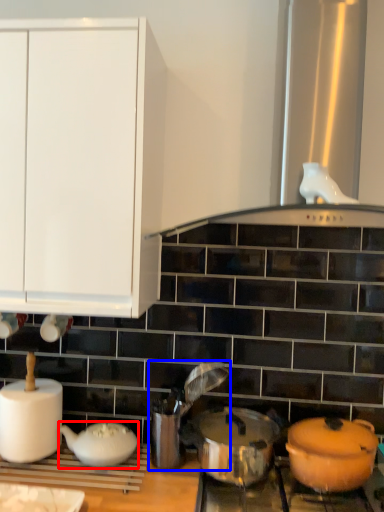
Question: Among these objects, which one is farthest to the camera, tableware (highlighted by a red box) or appliance (highlighted by a blue box)?

Choices:
 (A) tableware
 (B) appliance

Answer: (B)